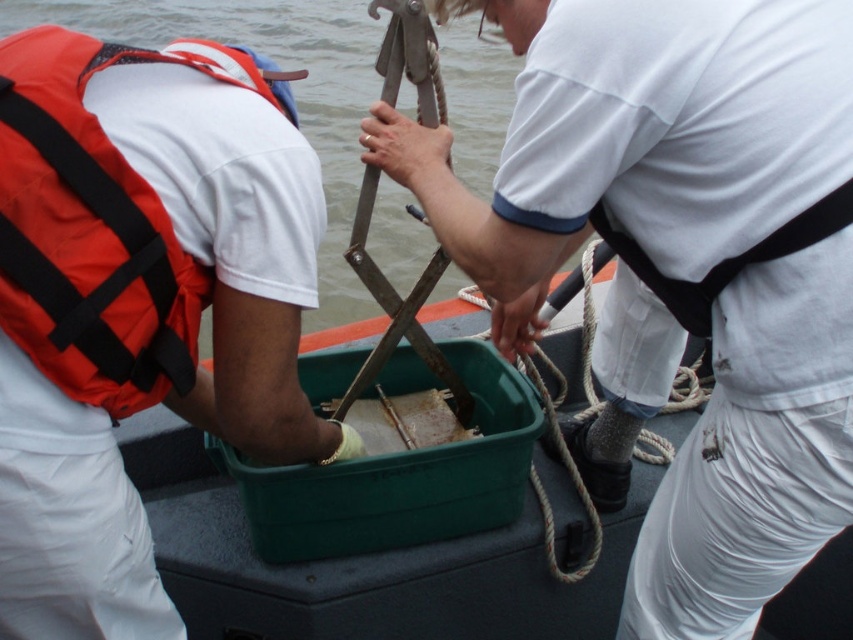
You are a safety inspector on a boat. You need to ensure that the white matte shirt at center is at least 7 feet away from the clear water at upper center for safety regulations. Based on the image, is the current distance compliant with the regulation?

The white matte shirt at center is 6.85 feet away from the clear water at upper center, which is less than the required 7 feet. Therefore, the current distance does not comply with the safety regulations.

You are a safety inspector reviewing this marine activity. You notice the white matte shirt at center and the clear water at upper center. Which object is positioned closer to the observer?

The white matte shirt at center is closer to the viewer than the clear water at upper center.